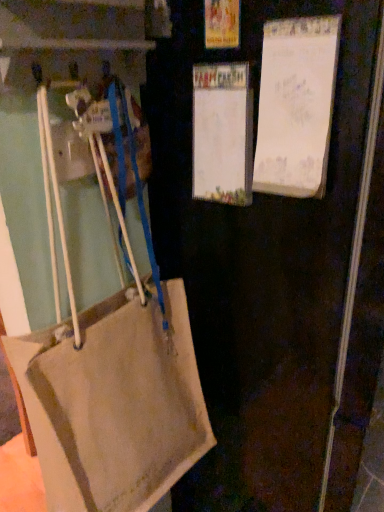
Question: Is white paper at upper right, acting as the second bulletin board starting from the left, further to the viewer compared to white paper at center, which is counted as the 1th bulletin board, starting from the left?

Choices:
 (A) no
 (B) yes

Answer: (A)

Question: Can you confirm if white paper at upper right, which appears as the first bulletin board when viewed from the right, is smaller than white paper at center, which is counted as the 1th bulletin board, starting from the left?

Choices:
 (A) yes
 (B) no

Answer: (B)

Question: Is white paper at upper right, acting as the second bulletin board starting from the left, positioned with its back to white paper at center, which is counted as the 1th bulletin board, starting from the left?

Choices:
 (A) no
 (B) yes

Answer: (A)

Question: Is white paper at upper right, acting as the second bulletin board starting from the left, next to white paper at center, which is counted as the 1th bulletin board, starting from the left, and touching it?

Choices:
 (A) yes
 (B) no

Answer: (A)

Question: From a real-world perspective, is white paper at upper right, acting as the second bulletin board starting from the left, physically below white paper at center, the 2th bulletin board viewed from the right?

Choices:
 (A) yes
 (B) no

Answer: (B)

Question: Is white paper at center, which is counted as the 1th bulletin board, starting from the left, located within white paper at upper right, which appears as the first bulletin board when viewed from the right?

Choices:
 (A) no
 (B) yes

Answer: (A)

Question: Is white paper at center, the 2th bulletin board viewed from the right, oriented towards beige fabric bag at left?

Choices:
 (A) no
 (B) yes

Answer: (B)

Question: Is white paper at center, the 2th bulletin board viewed from the right, taller than beige fabric bag at left?

Choices:
 (A) yes
 (B) no

Answer: (B)

Question: From the image's perspective, is white paper at center, which is counted as the 1th bulletin board, starting from the left, below beige fabric bag at left?

Choices:
 (A) yes
 (B) no

Answer: (B)

Question: From a real-world perspective, is white paper at center, which is counted as the 1th bulletin board, starting from the left, on top of beige fabric bag at left?

Choices:
 (A) no
 (B) yes

Answer: (B)

Question: Is white paper at center, which is counted as the 1th bulletin board, starting from the left, positioned with its back to beige fabric bag at left?

Choices:
 (A) no
 (B) yes

Answer: (B)

Question: Does white paper at center, the 2th bulletin board viewed from the right, come in front of beige fabric bag at left?

Choices:
 (A) yes
 (B) no

Answer: (B)

Question: Considering the relative sizes of white paper at center, the 2th bulletin board viewed from the right, and white paper at upper right, which appears as the first bulletin board when viewed from the right, in the image provided, is white paper at center, the 2th bulletin board viewed from the right, shorter than white paper at upper right, which appears as the first bulletin board when viewed from the right,?

Choices:
 (A) no
 (B) yes

Answer: (B)